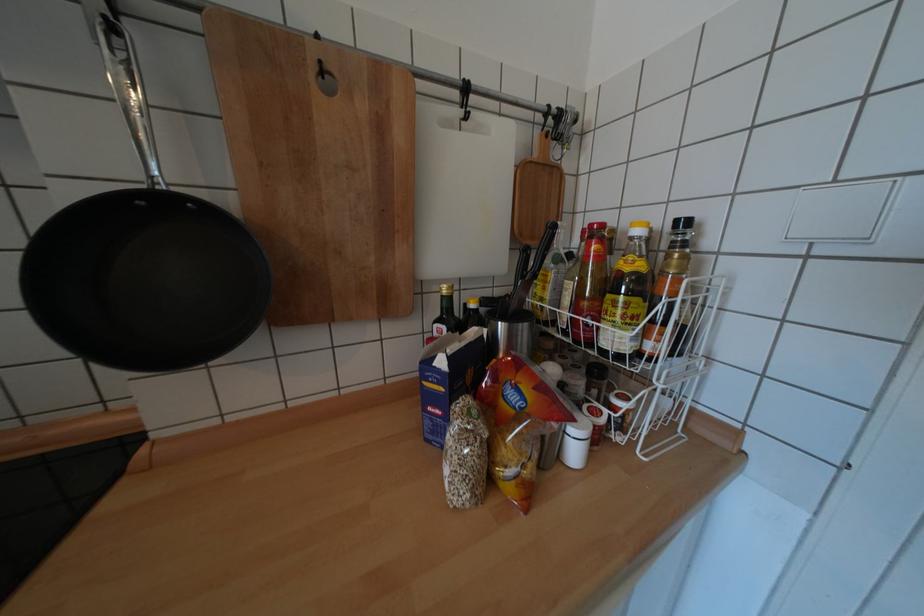
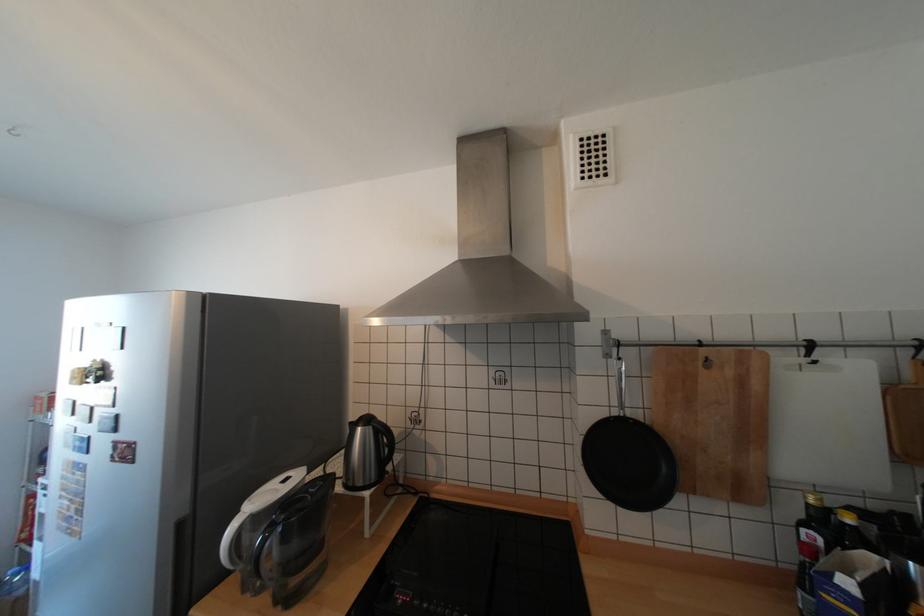
The point at (371, 105) is marked in the first image. Where is the corresponding point in the second image?

(738, 371)